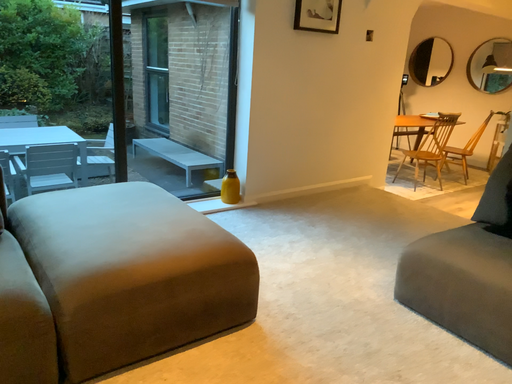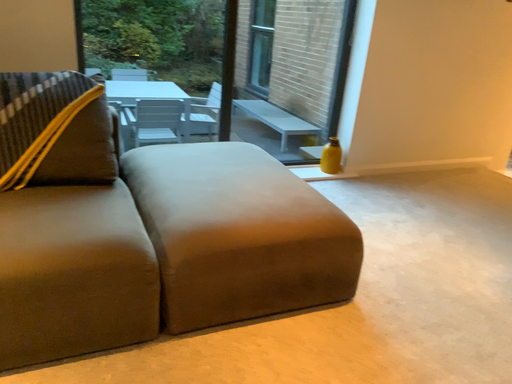
Question: Which way did the camera rotate in the video?

Choices:
 (A) rotated right
 (B) rotated left

Answer: (B)